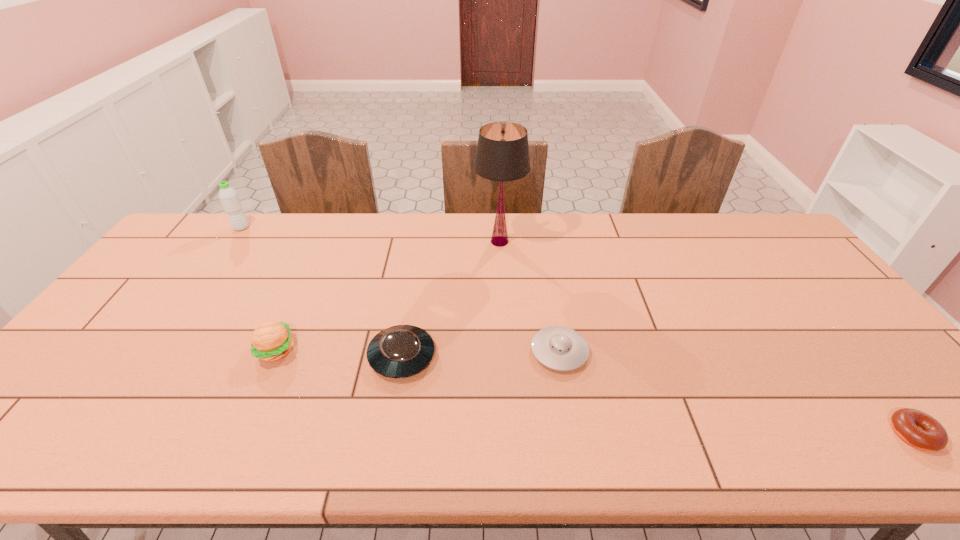
Locate an element on the screen. the shortest object is located at coordinates (920, 430).

The image size is (960, 540). Find the location of `vacant space situated 0.380m on the front-facing side of the tallest object`. vacant space situated 0.380m on the front-facing side of the tallest object is located at coordinates (506, 347).

You are a GUI agent. You are given a task and a screenshot of the screen. Output one action in this format:
    pyautogui.click(x=<x>, y=<y>)
    Task: Click on the vacant point located on the right of the leftmost object
    
    Given the screenshot: What is the action you would take?
    pyautogui.click(x=362, y=228)

Where is `free space located on the right of the hamburger`? free space located on the right of the hamburger is located at coordinates (408, 350).

I want to click on vacant region located 0.150m on the back of the left saucer, so click(x=413, y=294).

At what (x,y) coordinates should I click in order to perform the action: click on free point located on the front of the right saucer. Please return your answer as a coordinate pair (x, y). Image resolution: width=960 pixels, height=540 pixels. Looking at the image, I should click on (566, 392).

Where is `vacant space located on the left of the doughnut`? The image size is (960, 540). vacant space located on the left of the doughnut is located at coordinates (831, 434).

Image resolution: width=960 pixels, height=540 pixels. I want to click on lampshade present at the far edge, so click(x=502, y=154).

Locate an element on the screen. The image size is (960, 540). water bottle present at the far edge is located at coordinates (228, 196).

Identify the location of object situated at the near edge. (920, 430).